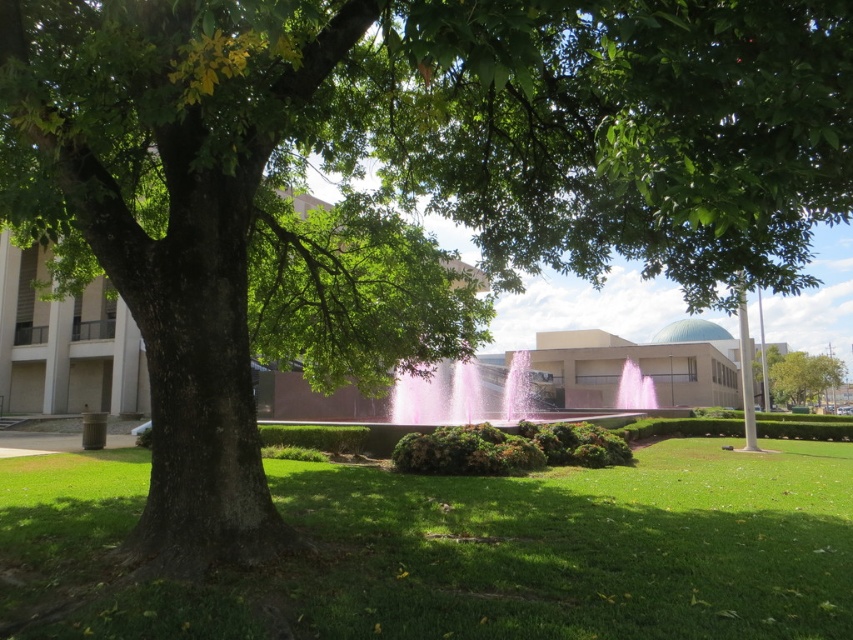
Between green grass at lower center and green leafy tree at right, which one is positioned lower?

green leafy tree at right

Who is positioned more to the left, green grass at lower center or green leafy tree at right?

green grass at lower center is more to the left.

Does point (378, 529) come farther from viewer compared to point (776, 362)?

That is False.

Where is `green grass at lower center`? The width and height of the screenshot is (853, 640). green grass at lower center is located at coordinates (463, 552).